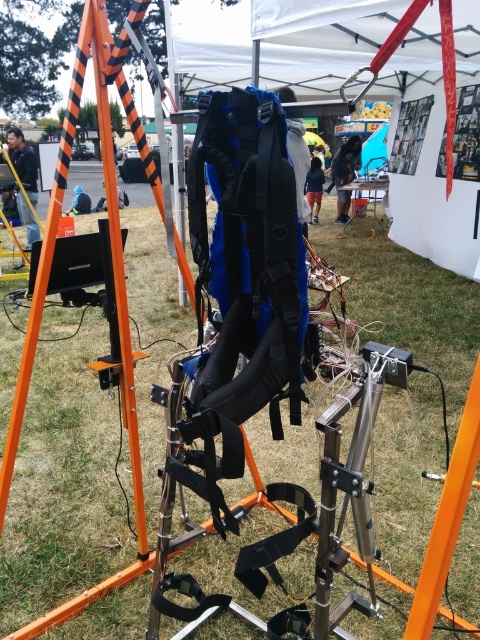
Does orange metallic ladder at center have a greater width compared to dark blue fabric jacket at center?

Yes, orange metallic ladder at center is wider than dark blue fabric jacket at center.

Who is positioned more to the right, orange metallic ladder at center or dark blue fabric jacket at center?

Positioned to the right is dark blue fabric jacket at center.

The height and width of the screenshot is (640, 480). I want to click on orange metallic ladder at center, so click(115, 296).

Does green grass at center have a lesser width compared to blue fabric jacket at center?

No, green grass at center is not thinner than blue fabric jacket at center.

Identify the location of green grass at center. Image resolution: width=480 pixels, height=640 pixels. (62, 486).

Can you confirm if matte black jacket at left is bigger than dark blue fabric jacket at center?

Correct, matte black jacket at left is larger in size than dark blue fabric jacket at center.

Who is shorter, matte black jacket at left or dark blue fabric jacket at center?

With less height is matte black jacket at left.

Does point (29, 184) come closer to viewer compared to point (349, 150)?

Yes.

Image resolution: width=480 pixels, height=640 pixels. What are the coordinates of `matte black jacket at left` in the screenshot? It's located at [x=24, y=163].